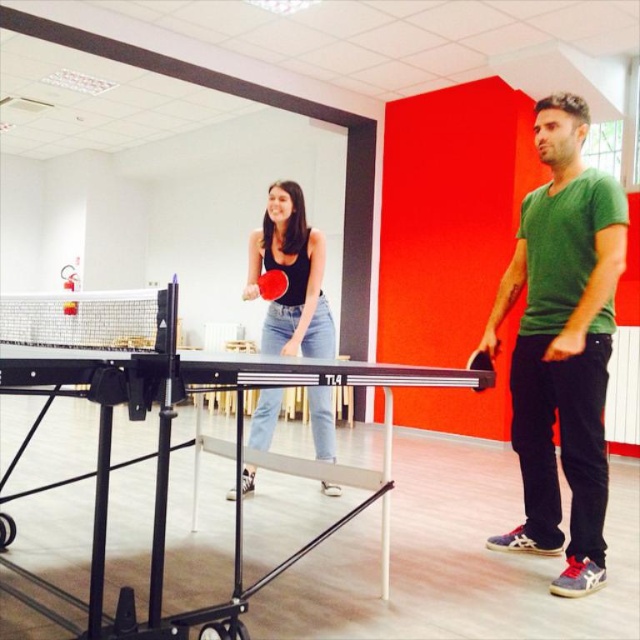
Which of these two, black matte ping pong paddle at center or black rubber paddle at right, stands taller?

With more height is black matte ping pong paddle at center.

Measure the distance from black matte ping pong paddle at center to black rubber paddle at right.

The distance of black matte ping pong paddle at center from black rubber paddle at right is 1.13 meters.

Is point (289, 221) behind point (481, 349)?

Yes.

Where is `black matte ping pong paddle at center`? Image resolution: width=640 pixels, height=640 pixels. black matte ping pong paddle at center is located at coordinates (291, 276).

Is rubber paddle at center behind black rubber paddle at right?

Yes.

Can you confirm if rubber paddle at center is positioned to the left of black rubber paddle at right?

Correct, you'll find rubber paddle at center to the left of black rubber paddle at right.

Identify the location of rubber paddle at center. (269, 285).

Does green matte t-shirt at right lie behind black rubber paddle at right?

Yes, green matte t-shirt at right is behind black rubber paddle at right.

Can you confirm if green matte t-shirt at right is positioned to the left of black rubber paddle at right?

No, green matte t-shirt at right is not to the left of black rubber paddle at right.

Is point (563, 538) more distant than point (468, 360)?

No, (563, 538) is in front of (468, 360).

At what (x,y) coordinates should I click in order to perform the action: click on green matte t-shirt at right. Please return your answer as a coordinate pair (x, y). This screenshot has width=640, height=640. Looking at the image, I should click on (563, 344).